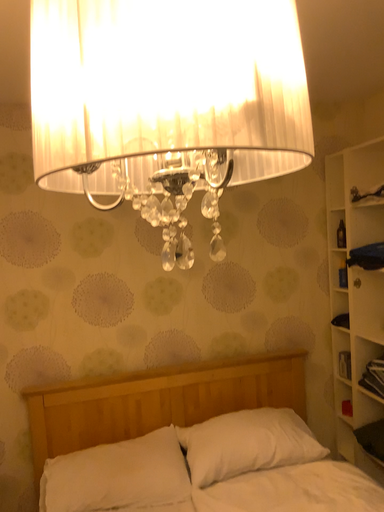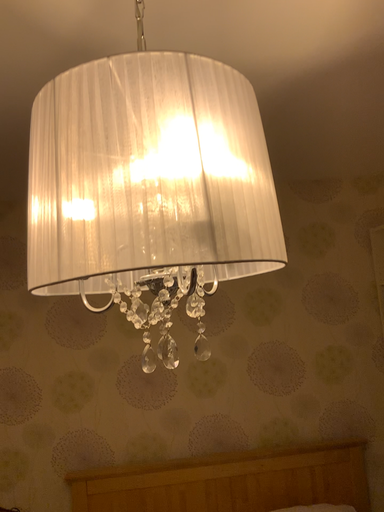
Question: Which way did the camera rotate in the video?

Choices:
 (A) rotated downward
 (B) rotated upward

Answer: (B)